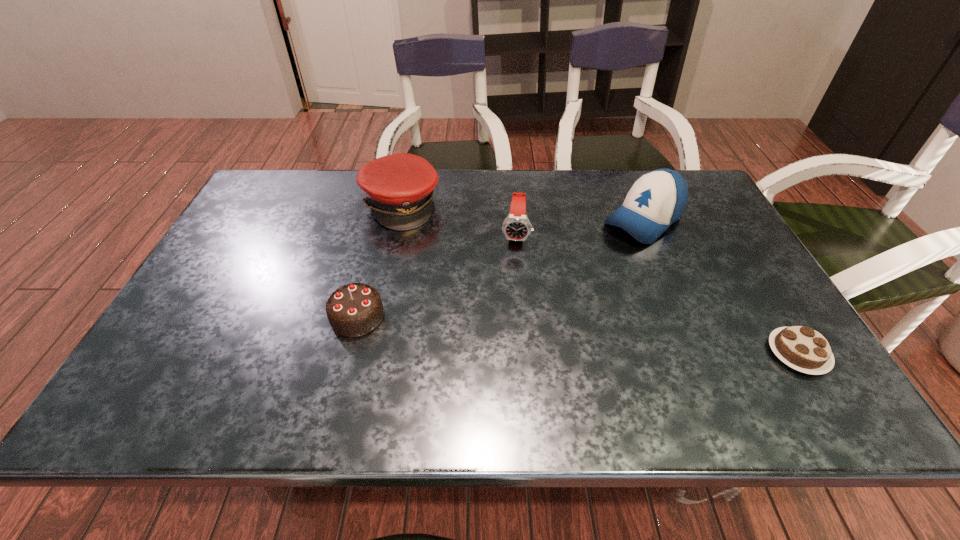
The height and width of the screenshot is (540, 960). Identify the location of free spot between the left chocolate cake and the cap. (379, 261).

I want to click on vacant space in between the shorter chocolate cake and the watch, so click(657, 294).

The height and width of the screenshot is (540, 960). Identify the location of free space between the third object from left to right and the right chocolate cake. (657, 294).

Identify the location of unoccupied area between the cap and the left chocolate cake. Image resolution: width=960 pixels, height=540 pixels. (379, 261).

Locate an element on the screen. Image resolution: width=960 pixels, height=540 pixels. free spot between the right chocolate cake and the cap is located at coordinates (600, 279).

You are a GUI agent. You are given a task and a screenshot of the screen. Output one action in this format:
    pyautogui.click(x=<x>, y=<y>)
    Task: Click on the unoccupied position between the taller chocolate cake and the baseball cap
    
    Given the screenshot: What is the action you would take?
    pyautogui.click(x=500, y=268)

This screenshot has height=540, width=960. I want to click on free point between the second object from right to left and the watch, so click(x=580, y=227).

The height and width of the screenshot is (540, 960). Find the location of `vacant area between the cap and the third object from right to left`. vacant area between the cap and the third object from right to left is located at coordinates (458, 220).

Where is `unoccupied position between the third object from left to right and the right chocolate cake`? The image size is (960, 540). unoccupied position between the third object from left to right and the right chocolate cake is located at coordinates (657, 294).

I want to click on the closest object to the cap, so click(516, 227).